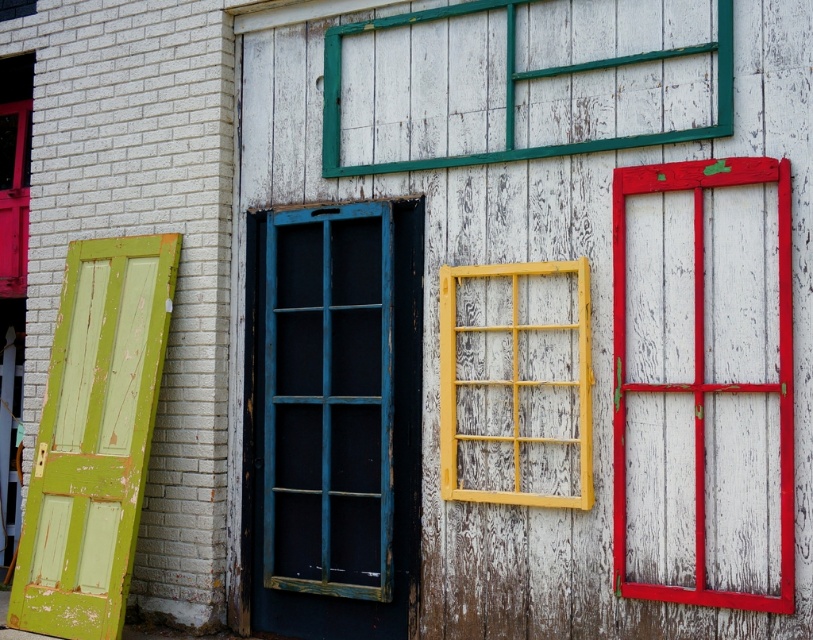
You are standing in front of the rustic wooden structure and want to touch both points on the wall. Which point should you reach for first, point A at coordinates point [311,499] or point B at coordinates point [564,332]?

You should reach for point A at coordinates point [311,499] first because it is closer to you than point B at coordinates point [564,332].

You are an interior designer assessing the rustic wooden structure. You need to determine which window, the yellow wood window at center or the smooth painted wood window at right, would require a taller frame for installation. Based on the scene, which one needs a taller frame?

The smooth painted wood window at right requires a taller frame because the yellow wood window at center is not as tall as it.

You are standing in front of the rustic wooden structure and want to locate two specific points marked on the wall. The first point is at coordinate point (x=64, y=422) and the second is at point (x=638, y=390). From your vantage point, which point is closer to the front of the structure?

Point (x=638, y=390) is closer to the front of the structure because point (x=64, y=422) is behind it according to their spatial relationship.